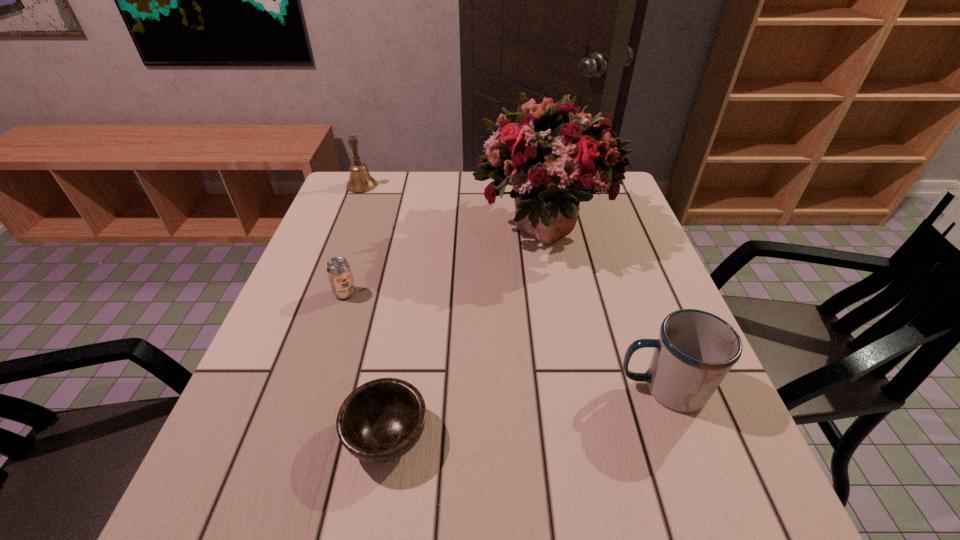
The image size is (960, 540). In order to click on empty space that is in between the bouquet and the beer can in this screenshot , I will do `click(444, 260)`.

Identify the location of empty space that is in between the bouquet and the third nearest object. The width and height of the screenshot is (960, 540). (444, 260).

Where is `unoccupied position between the bell and the beer can`? The width and height of the screenshot is (960, 540). unoccupied position between the bell and the beer can is located at coordinates point(353,239).

Image resolution: width=960 pixels, height=540 pixels. I want to click on empty space that is in between the bell and the tallest object, so click(x=452, y=207).

Identify the location of unoccupied position between the bouquet and the bowl. (466, 332).

Find the location of a particular element. The width and height of the screenshot is (960, 540). vacant space that is in between the fourth tallest object and the bowl is located at coordinates (366, 364).

At what (x,y) coordinates should I click in order to perform the action: click on free spot between the mug and the bouquet. Please return your answer as a coordinate pair (x, y). This screenshot has height=540, width=960. Looking at the image, I should click on (604, 308).

The height and width of the screenshot is (540, 960). I want to click on vacant area that lies between the mug and the bouquet, so click(604, 308).

Choose which object is the fourth nearest neighbor to the third object from left to right. Please provide its 2D coordinates. Your answer should be formatted as a tuple, i.e. [(x, y)], where the tuple contains the x and y coordinates of a point satisfying the conditions above.

[(360, 181)]

I want to click on object that is the fourth closest one to the mug, so click(360, 181).